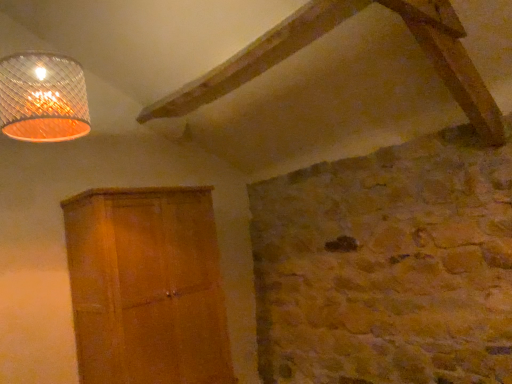
Question: Should I look upward or downward to see wooden at left?

Choices:
 (A) up
 (B) down

Answer: (B)